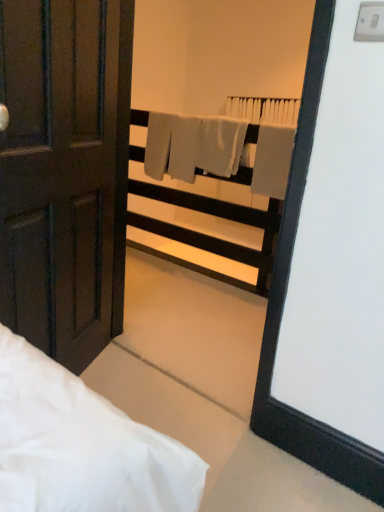
Question: Can you see matte dark brown door at left touching white plastic balustrade at upper center?

Choices:
 (A) no
 (B) yes

Answer: (A)

Question: Is matte dark brown door at left oriented away from white plastic balustrade at upper center?

Choices:
 (A) yes
 (B) no

Answer: (B)

Question: Does matte dark brown door at left appear on the right side of white plastic balustrade at upper center?

Choices:
 (A) yes
 (B) no

Answer: (B)

Question: Can you confirm if matte dark brown door at left is thinner than white plastic balustrade at upper center?

Choices:
 (A) yes
 (B) no

Answer: (A)

Question: Would you consider matte dark brown door at left to be distant from white plastic balustrade at upper center?

Choices:
 (A) yes
 (B) no

Answer: (A)

Question: Relative to gray matte towel at center, is white plastic balustrade at upper center in front or behind?

Choices:
 (A) front
 (B) behind

Answer: (B)

Question: Does point (273, 226) appear closer or farther from the camera than point (266, 165)?

Choices:
 (A) farther
 (B) closer

Answer: (A)

Question: From the image's perspective, is white plastic balustrade at upper center positioned above or below gray matte towel at center?

Choices:
 (A) below
 (B) above

Answer: (A)

Question: In the image, is white plastic balustrade at upper center on the left side or the right side of gray matte towel at center?

Choices:
 (A) left
 (B) right

Answer: (A)

Question: From the image's perspective, is matte dark brown door at left located above or below gray matte towel at center?

Choices:
 (A) below
 (B) above

Answer: (A)

Question: From a real-world perspective, relative to gray matte towel at center, is matte dark brown door at left vertically above or below?

Choices:
 (A) below
 (B) above

Answer: (A)

Question: Is matte dark brown door at left inside the boundaries of gray matte towel at center, or outside?

Choices:
 (A) inside
 (B) outside

Answer: (B)

Question: Based on their sizes in the image, would you say matte dark brown door at left is bigger or smaller than gray matte towel at center?

Choices:
 (A) small
 (B) big

Answer: (B)

Question: Considering the positions of white plastic balustrade at upper center and matte dark brown door at left in the image, is white plastic balustrade at upper center wider or thinner than matte dark brown door at left?

Choices:
 (A) wide
 (B) thin

Answer: (A)

Question: Would you say white plastic balustrade at upper center is to the left or to the right of matte dark brown door at left in the picture?

Choices:
 (A) left
 (B) right

Answer: (B)